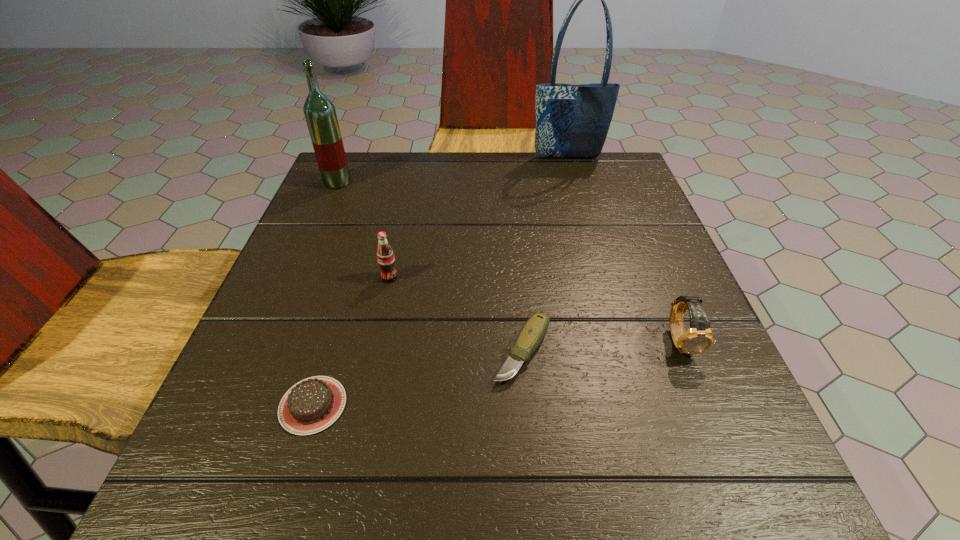
Select which object appears as the third closest to the fourth object from right to left. Please provide its 2D coordinates. Your answer should be formatted as a tuple, i.e. [(x, y)], where the tuple contains the x and y coordinates of a point satisfying the conditions above.

[(320, 114)]

Locate which object ranks fifth in proximity to the tallest object. Please provide its 2D coordinates. Your answer should be formatted as a tuple, i.e. [(x, y)], where the tuple contains the x and y coordinates of a point satisfying the conditions above.

[(313, 404)]

The width and height of the screenshot is (960, 540). I want to click on free location that satisfies the following two spatial constraints: 1. on the back side of the third object from left to right; 2. on the left side of the chocolate cake, so click(x=351, y=278).